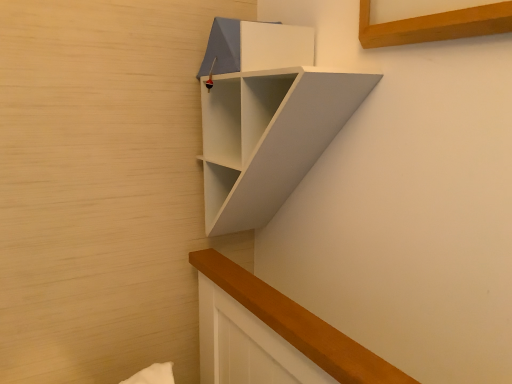
Question: From the image's perspective, would you say white matte cabinet at upper center is shown under white matte shelf at upper center?

Choices:
 (A) yes
 (B) no

Answer: (B)

Question: Considering the relative sizes of white matte cabinet at upper center and white matte shelf at upper center in the image provided, is white matte cabinet at upper center shorter than white matte shelf at upper center?

Choices:
 (A) yes
 (B) no

Answer: (A)

Question: Is white matte cabinet at upper center positioned before white matte shelf at upper center?

Choices:
 (A) no
 (B) yes

Answer: (A)

Question: Is white matte cabinet at upper center to the left of white matte shelf at upper center from the viewer's perspective?

Choices:
 (A) no
 (B) yes

Answer: (B)

Question: Considering the relative positions of white matte cabinet at upper center and white matte shelf at upper center in the image provided, is white matte cabinet at upper center to the right of white matte shelf at upper center from the viewer's perspective?

Choices:
 (A) no
 (B) yes

Answer: (A)

Question: Is white matte cabinet at upper center far from white matte shelf at upper center?

Choices:
 (A) yes
 (B) no

Answer: (B)

Question: Does white matte shelf at upper center appear on the right side of white matte cabinet at upper center?

Choices:
 (A) no
 (B) yes

Answer: (B)

Question: Considering the relative sizes of white matte shelf at upper center and white matte cabinet at upper center in the image provided, is white matte shelf at upper center wider than white matte cabinet at upper center?

Choices:
 (A) yes
 (B) no

Answer: (A)

Question: From a real-world perspective, is white matte shelf at upper center over white matte cabinet at upper center?

Choices:
 (A) yes
 (B) no

Answer: (B)

Question: Are white matte shelf at upper center and white matte cabinet at upper center far apart?

Choices:
 (A) no
 (B) yes

Answer: (A)

Question: Considering the relative sizes of white matte shelf at upper center and white matte cabinet at upper center in the image provided, is white matte shelf at upper center taller than white matte cabinet at upper center?

Choices:
 (A) no
 (B) yes

Answer: (B)

Question: Is white matte shelf at upper center positioned behind white matte cabinet at upper center?

Choices:
 (A) yes
 (B) no

Answer: (B)

Question: Is point (309, 77) closer or farther from the camera than point (288, 52)?

Choices:
 (A) closer
 (B) farther

Answer: (A)